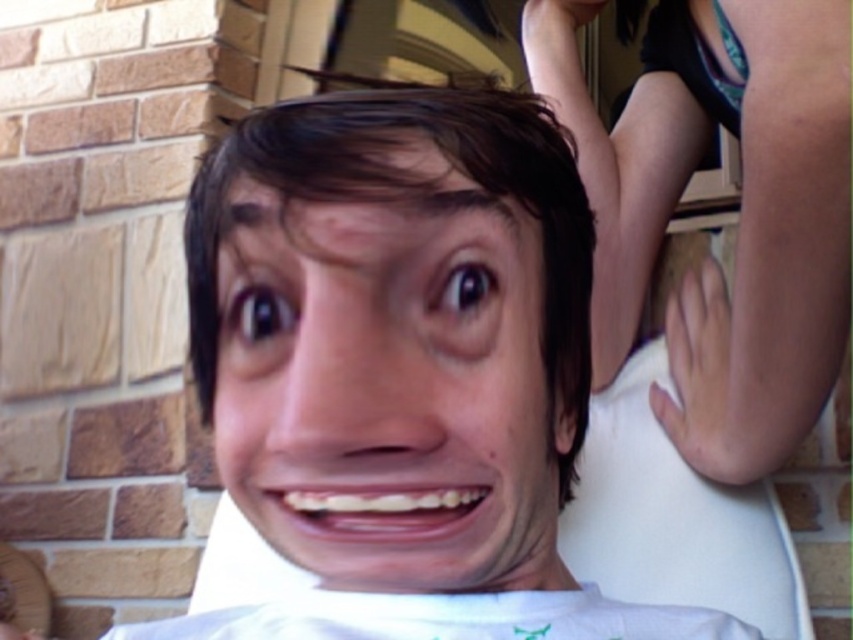
Question: Can you confirm if smooth skin hand at upper right is positioned to the right of pale skin hand at upper right?

Choices:
 (A) no
 (B) yes

Answer: (A)

Question: Is brown matte hair at center in front of pale skin hand at upper right?

Choices:
 (A) no
 (B) yes

Answer: (B)

Question: Does brown matte hair at center appear over pale skin hand at upper right?

Choices:
 (A) no
 (B) yes

Answer: (B)

Question: Which of these objects is positioned closest to the white matte shirt at center?

Choices:
 (A) pale skin hand at upper right
 (B) brown matte hair at center

Answer: (B)

Question: Which of the following is the farthest from the observer?

Choices:
 (A) pale skin hand at upper right
 (B) brown matte hair at center
 (C) smooth skin hand at upper right
 (D) white matte shirt at center

Answer: (A)

Question: Among these objects, which one is nearest to the camera?

Choices:
 (A) pale skin hand at upper right
 (B) white matte shirt at center
 (C) smooth skin hand at upper right

Answer: (B)